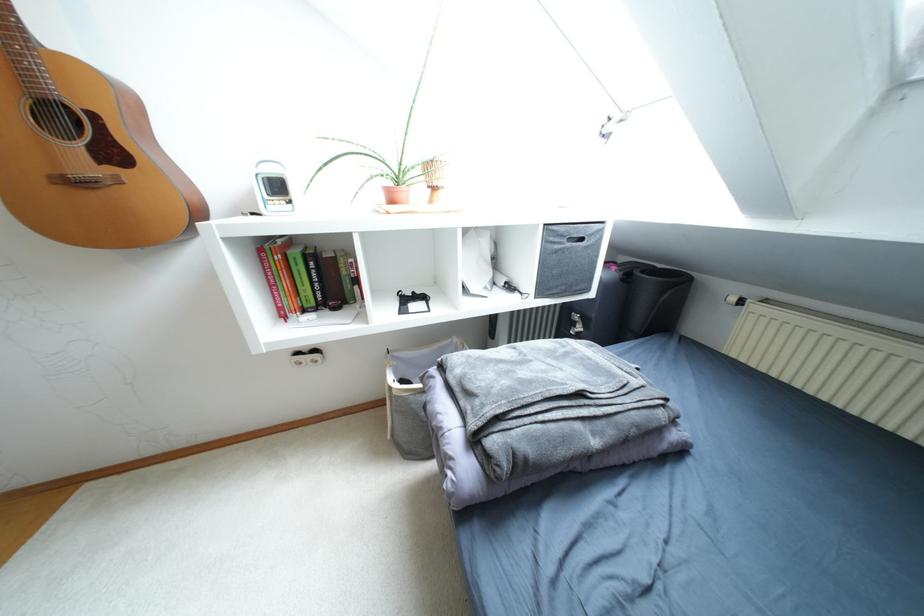
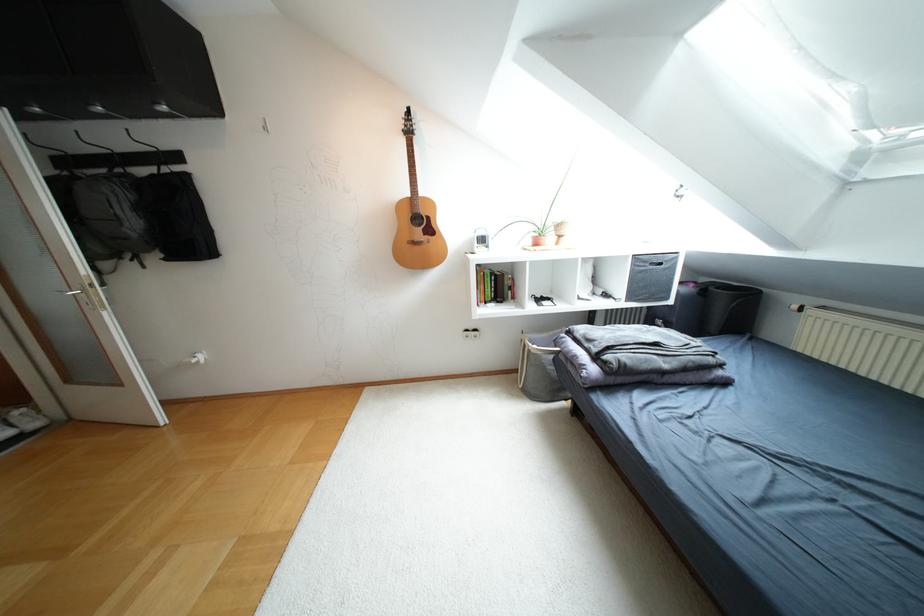
Where in the second image is the point corresponding to [799,331] from the first image?

(847, 326)